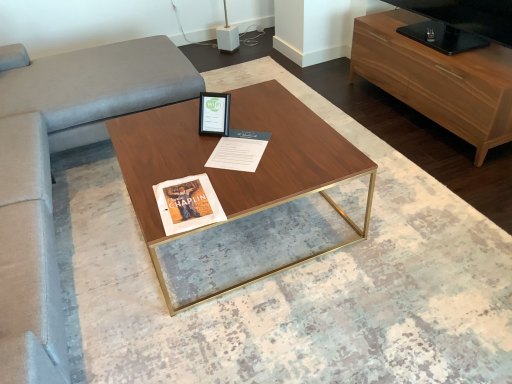
Question: Would you say white paper at center is inside or outside velvet couch at left?

Choices:
 (A) outside
 (B) inside

Answer: (A)

Question: Based on their sizes in the image, would you say white paper at center is bigger or smaller than velvet couch at left?

Choices:
 (A) small
 (B) big

Answer: (A)

Question: Considering the real-world distances, which object is closest to the velvet couch at left?

Choices:
 (A) matte black picture frame at center
 (B) walnut wood coffee table at center
 (C) white paper at center
 (D) wooden cabinet at right

Answer: (B)

Question: Estimate the real-world distances between objects in this image. Which object is closer to the white paper at center?

Choices:
 (A) walnut wood coffee table at center
 (B) wooden cabinet at right
 (C) velvet couch at left
 (D) matte black picture frame at center

Answer: (D)